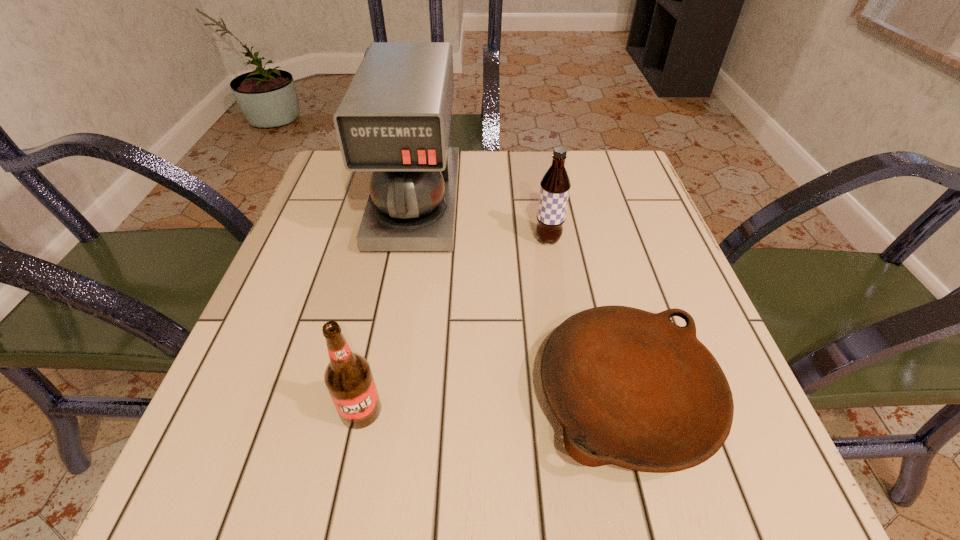
This screenshot has width=960, height=540. Find the location of `object situated at the left edge`. object situated at the left edge is located at coordinates (394, 119).

In order to click on object that is at the right edge in this screenshot , I will do `click(636, 390)`.

Find the location of a particular element. This screenshot has height=540, width=960. object that is at the far left corner is located at coordinates (394, 119).

The width and height of the screenshot is (960, 540). Identify the location of object that is positioned at the near right corner. (636, 390).

Where is `free space at the far edge`? free space at the far edge is located at coordinates (518, 178).

You are a GUI agent. You are given a task and a screenshot of the screen. Output one action in this format:
    pyautogui.click(x=<x>, y=<y>)
    Task: Click on the vacant space at the near edge
    
    Given the screenshot: What is the action you would take?
    pyautogui.click(x=644, y=504)

Find the location of a particular element. vacant space at the left edge of the desktop is located at coordinates (309, 324).

Where is `free point at the right edge`? This screenshot has width=960, height=540. free point at the right edge is located at coordinates (647, 242).

You are a GUI agent. You are given a task and a screenshot of the screen. Output one action in this format:
    pyautogui.click(x=<x>, y=<y>)
    Task: Click on the free space at the far left corner of the desktop
    
    Given the screenshot: What is the action you would take?
    pyautogui.click(x=324, y=204)

Where is `free space at the near left corner of the desktop`? free space at the near left corner of the desktop is located at coordinates (225, 457).